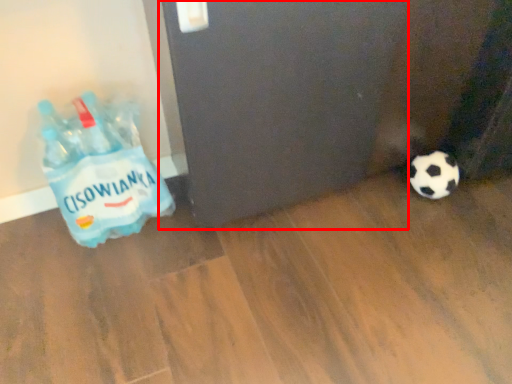
Question: From the image's perspective, what is the correct spatial relationship of screen door (annotated by the red box) in relation to bottle?

Choices:
 (A) below
 (B) above

Answer: (B)